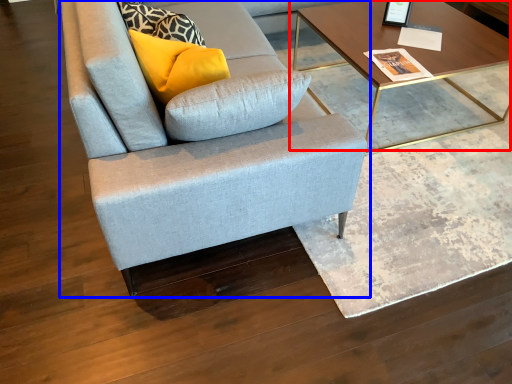
Question: Which of the following is the closest to the observer, coffee table (highlighted by a red box) or studio couch (highlighted by a blue box)?

Choices:
 (A) coffee table
 (B) studio couch

Answer: (B)